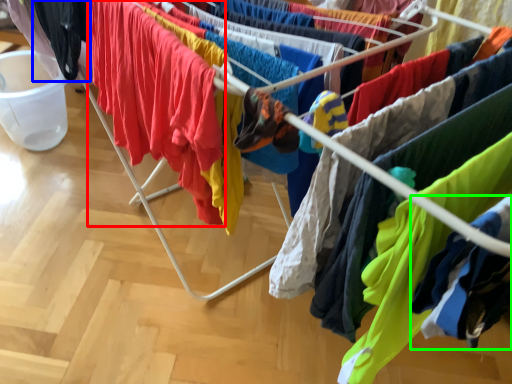
Question: Which object is the closest to the clothing (highlighted by a red box)? Choose among these: clothing (highlighted by a blue box) or clothing (highlighted by a green box).

Choices:
 (A) clothing
 (B) clothing

Answer: (A)